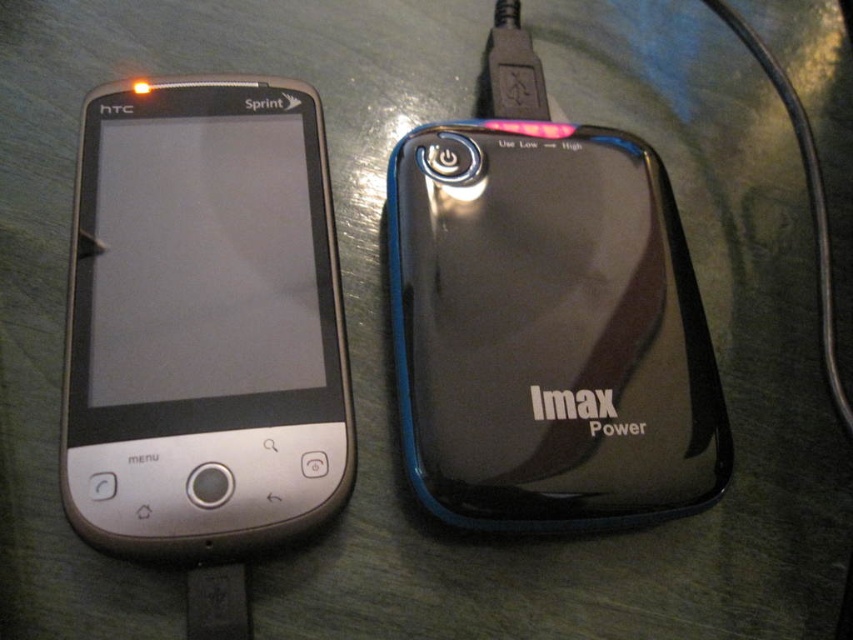
You have a large book that is 12 inches wide and want to place it on the table between the silver metallic smartphone at left and the black glossy power bank at right. Will the book fit without overlapping either device?

The silver metallic smartphone at left and black glossy power bank at right are 11.30 inches apart from each other. Since the book is 12 inches wide, it will not fit between them without overlapping the devices.

You are organizing your desk and want to place a small decorative item between the silver metallic smartphone at left and the black glossy power bank at right. Based on their positions, which device should the item be placed closer to?

The silver metallic smartphone at left is closer to the viewer than the black glossy power bank at right, so the decorative item should be placed closer to the silver metallic smartphone at left to maintain visual balance.

You are organizing items on a desk and want to place a new item between the silver metallic smartphone at left and the black glossy power bank at right. Is there enough space between them to fit a 5 cm wide object?

The silver metallic smartphone at left is positioned on the left side of black glossy power bank at right, but the exact distance between them isn not specified. Without knowing the spacing, it is impossible to determine if a 5 cm wide object would fit between them.